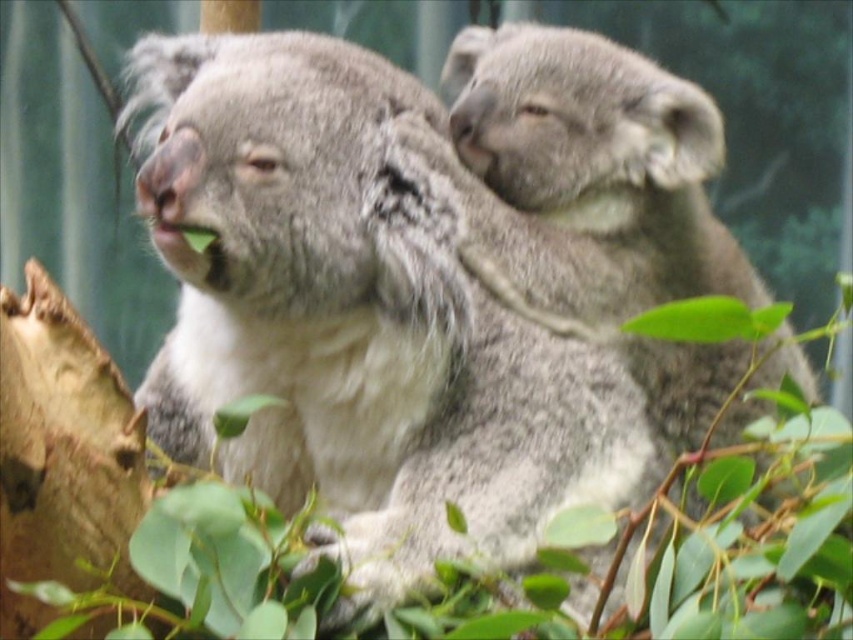
Between gray furry koala at center and fuzzy gray koala at upper right, which one has less height?

With less height is gray furry koala at center.

Which is behind, point (421, 156) or point (577, 157)?

The point (577, 157) is behind.

Locate an element on the screen. This screenshot has height=640, width=853. gray furry koala at center is located at coordinates (364, 312).